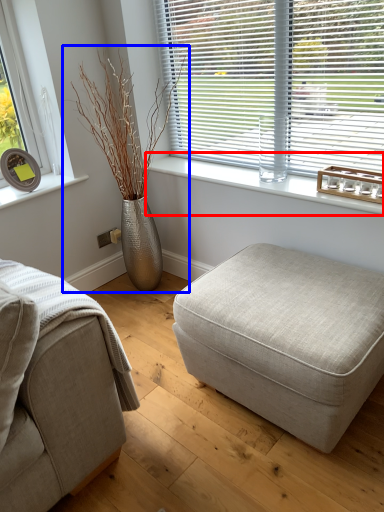
Question: Which of the following is the farthest to the observer, window sill (highlighted by a red box) or houseplant (highlighted by a blue box)?

Choices:
 (A) window sill
 (B) houseplant

Answer: (B)